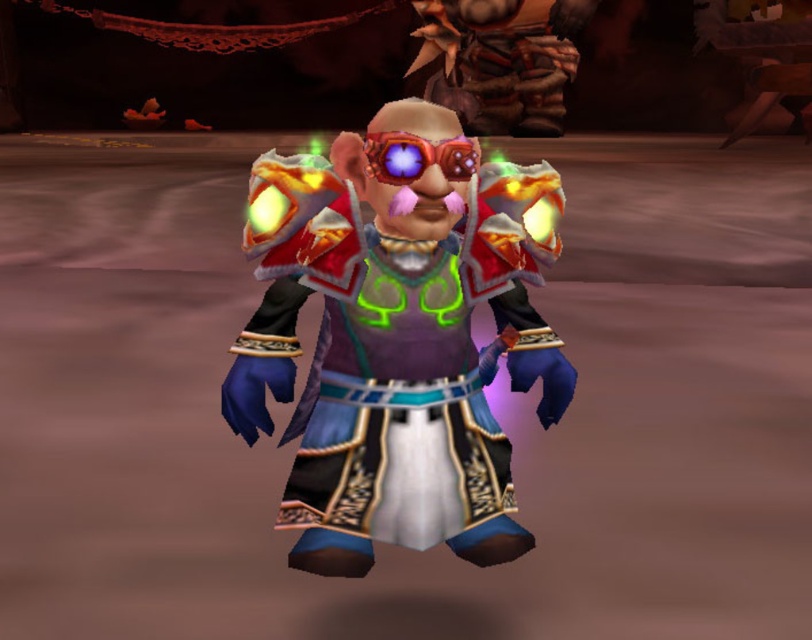
Question: In this image, where is shiny metallic armor at center located relative to translucent red goggles at center?

Choices:
 (A) left
 (B) right

Answer: (A)

Question: Can you confirm if shiny metallic armor at center is smaller than translucent red goggles at center?

Choices:
 (A) no
 (B) yes

Answer: (A)

Question: Which of the following is the closest to the observer?

Choices:
 (A) shiny metallic armor at center
 (B) translucent red goggles at center

Answer: (B)

Question: Which of the following is the farthest from the observer?

Choices:
 (A) translucent red goggles at center
 (B) shiny metallic armor at center

Answer: (B)

Question: Is shiny metallic armor at center behind translucent red goggles at center?

Choices:
 (A) yes
 (B) no

Answer: (A)